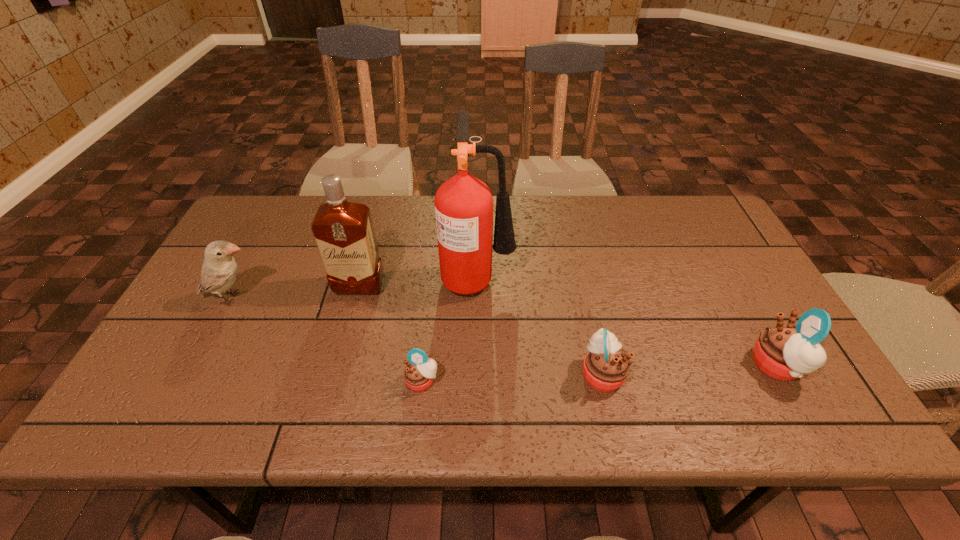
Where is `the leftmost muffin`? The height and width of the screenshot is (540, 960). the leftmost muffin is located at coordinates (419, 373).

You are a GUI agent. You are given a task and a screenshot of the screen. Output one action in this format:
    pyautogui.click(x=<x>, y=<y>)
    Task: Click on the shortest muffin
    Image resolution: width=960 pixels, height=540 pixels.
    Given the screenshot: What is the action you would take?
    pyautogui.click(x=419, y=373)

Where is `the fifth object from left to right`? Image resolution: width=960 pixels, height=540 pixels. the fifth object from left to right is located at coordinates (605, 367).

This screenshot has width=960, height=540. In order to click on the second shortest object in this screenshot , I will do `click(605, 367)`.

Locate an element on the screen. The width and height of the screenshot is (960, 540). the rightmost muffin is located at coordinates (785, 352).

Find the location of a particular element. the second tallest object is located at coordinates (344, 233).

At what (x,y) coordinates should I click in order to perform the action: click on liquor. Please return your answer as a coordinate pair (x, y). Looking at the image, I should click on (344, 233).

At what (x,y) coordinates should I click in order to perform the action: click on the tallest object. Please return your answer as a coordinate pair (x, y). Looking at the image, I should click on (463, 204).

Locate an element on the screen. the leftmost object is located at coordinates (219, 270).

This screenshot has width=960, height=540. Identify the location of free spot located on the front-facing side of the fifth object from left to right. click(x=787, y=374).